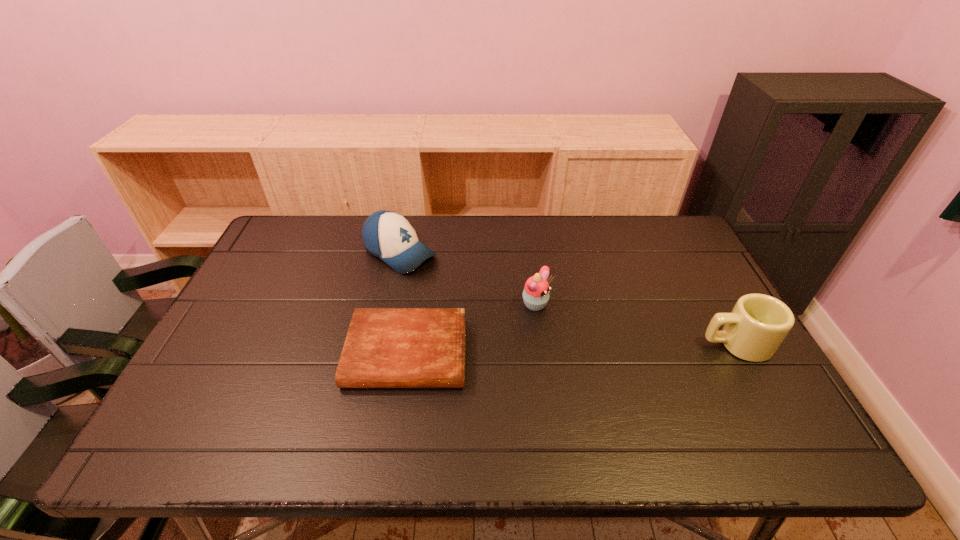
Identify the location of blank space at the left edge of the desktop. Image resolution: width=960 pixels, height=540 pixels. (240, 298).

The image size is (960, 540). In the image, there is a desktop. In order to click on vacant space at the right edge in this screenshot , I will do `click(692, 281)`.

At what (x,y) coordinates should I click in order to perform the action: click on vacant space at the far right corner of the desktop. Please return your answer as a coordinate pair (x, y). This screenshot has height=540, width=960. Looking at the image, I should click on (684, 230).

Identify the location of vacant position at the near right corner of the desktop. This screenshot has width=960, height=540. click(x=777, y=406).

The width and height of the screenshot is (960, 540). I want to click on free spot between the rightmost object and the Bible, so click(x=571, y=349).

The image size is (960, 540). I want to click on vacant area that lies between the mug and the baseball cap, so click(568, 299).

Find the location of a particular element. free spot between the farthest object and the mug is located at coordinates (568, 299).

Image resolution: width=960 pixels, height=540 pixels. What are the coordinates of `vacant area that lies between the second object from right to left and the baseball cap` in the screenshot? It's located at (468, 280).

This screenshot has width=960, height=540. I want to click on blank region between the baseball cap and the third object from left to right, so click(468, 280).

Where is `vacant space that's between the baseball cap and the shortest object`? Image resolution: width=960 pixels, height=540 pixels. vacant space that's between the baseball cap and the shortest object is located at coordinates (403, 303).